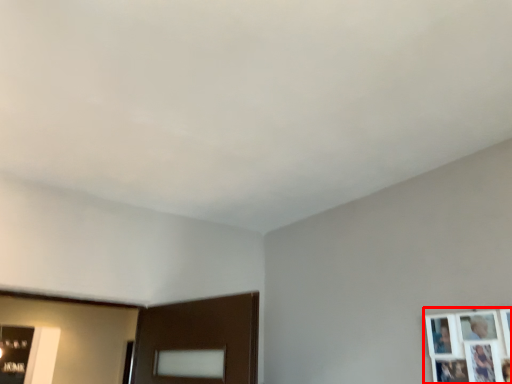
Question: Considering the relative positions of picture frame (annotated by the red box) and picture frame in the image provided, where is picture frame (annotated by the red box) located with respect to the staircase?

Choices:
 (A) right
 (B) left

Answer: (A)